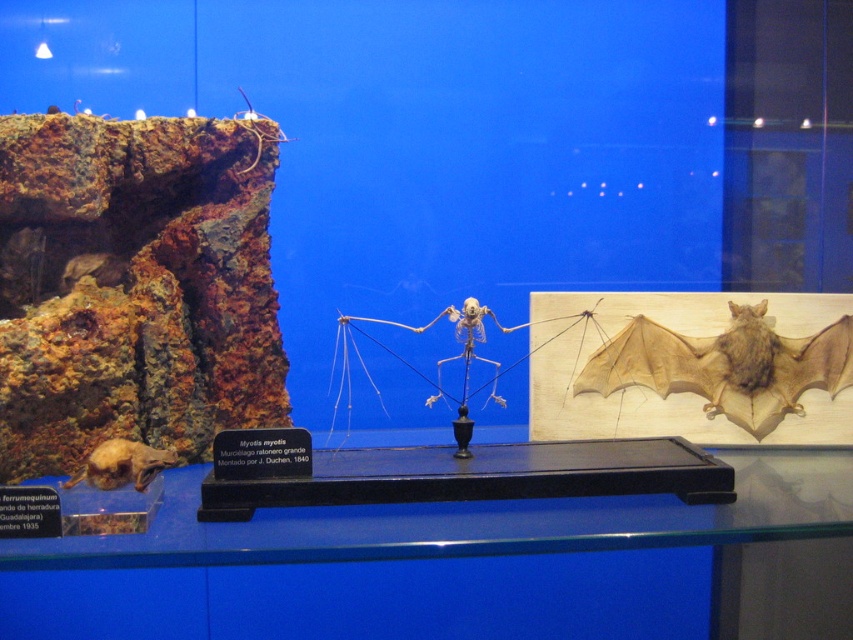
Who is positioned more to the right, brown leather bat at center or brown furry bat at lower left?

brown leather bat at center is more to the right.

Which is below, brown leather bat at center or brown furry bat at lower left?

Positioned lower is brown furry bat at lower left.

The height and width of the screenshot is (640, 853). I want to click on brown leather bat at center, so click(726, 365).